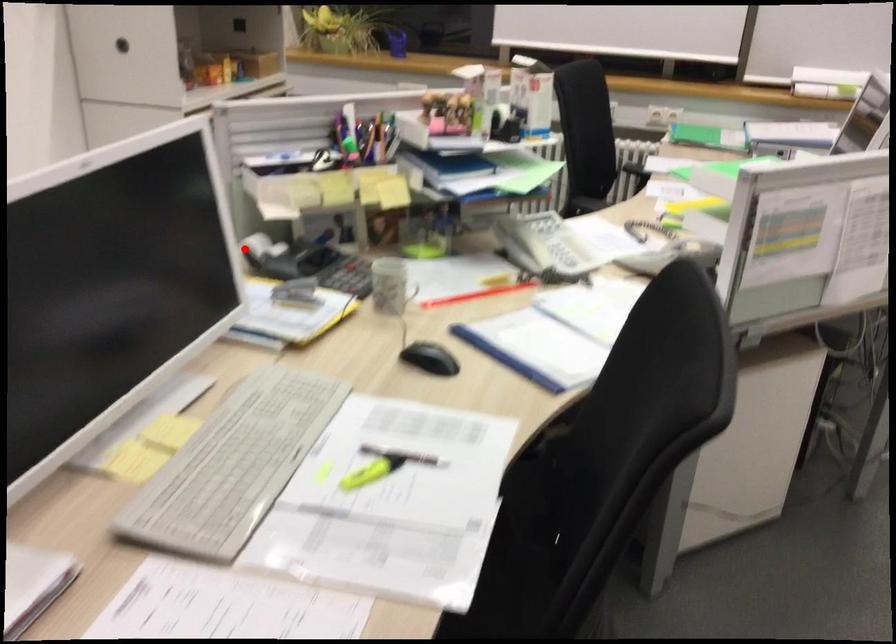
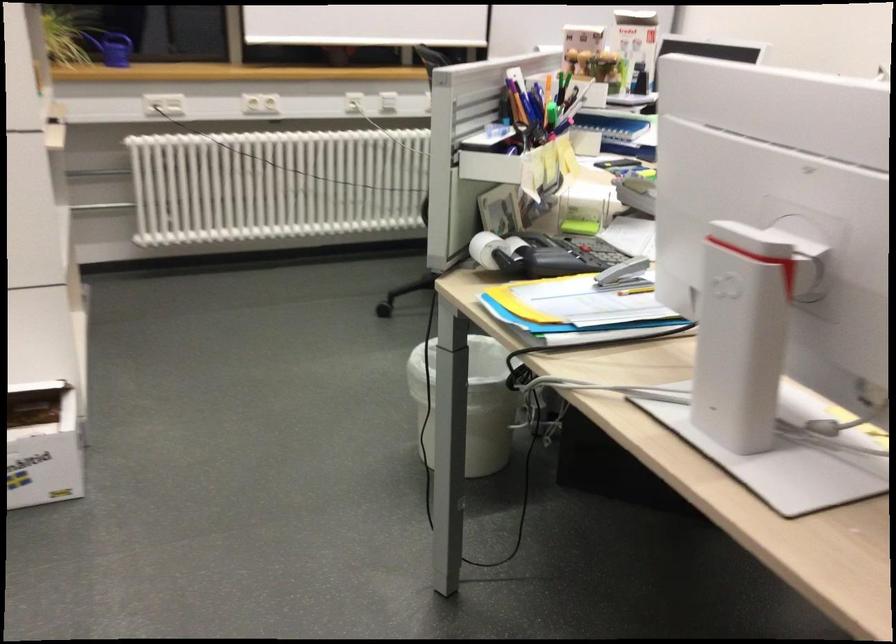
Where in the second image is the point corresponding to the highlighted location from the first image?

(485, 249)